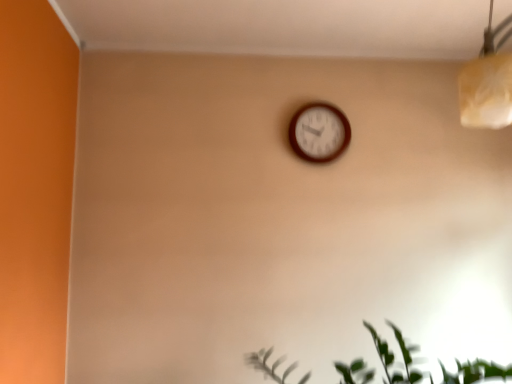
Question: Is wooden wall clock at center to the left of green leafy plant at lower right from the viewer's perspective?

Choices:
 (A) no
 (B) yes

Answer: (B)

Question: From the image's perspective, is wooden wall clock at center over green leafy plant at lower right?

Choices:
 (A) no
 (B) yes

Answer: (B)

Question: Is wooden wall clock at center far away from green leafy plant at lower right?

Choices:
 (A) yes
 (B) no

Answer: (B)

Question: Does wooden wall clock at center lie behind green leafy plant at lower right?

Choices:
 (A) no
 (B) yes

Answer: (B)

Question: Is wooden wall clock at center directly adjacent to green leafy plant at lower right?

Choices:
 (A) no
 (B) yes

Answer: (A)

Question: Considering the relative positions of wooden wall clock at center and green leafy plant at lower right in the image provided, is wooden wall clock at center in front of green leafy plant at lower right?

Choices:
 (A) no
 (B) yes

Answer: (A)

Question: Could you tell me if green leafy plant at lower right is facing wooden wall clock at center?

Choices:
 (A) yes
 (B) no

Answer: (B)

Question: From a real-world perspective, is green leafy plant at lower right beneath wooden wall clock at center?

Choices:
 (A) yes
 (B) no

Answer: (A)

Question: Can you confirm if green leafy plant at lower right is smaller than wooden wall clock at center?

Choices:
 (A) yes
 (B) no

Answer: (B)

Question: Is the position of green leafy plant at lower right more distant than that of wooden wall clock at center?

Choices:
 (A) no
 (B) yes

Answer: (A)

Question: Is green leafy plant at lower right not close to wooden wall clock at center?

Choices:
 (A) yes
 (B) no

Answer: (B)

Question: Considering the relative sizes of green leafy plant at lower right and wooden wall clock at center in the image provided, is green leafy plant at lower right thinner than wooden wall clock at center?

Choices:
 (A) yes
 (B) no

Answer: (B)

Question: In the image, is green leafy plant at lower right positioned in front of or behind wooden wall clock at center?

Choices:
 (A) behind
 (B) front

Answer: (B)